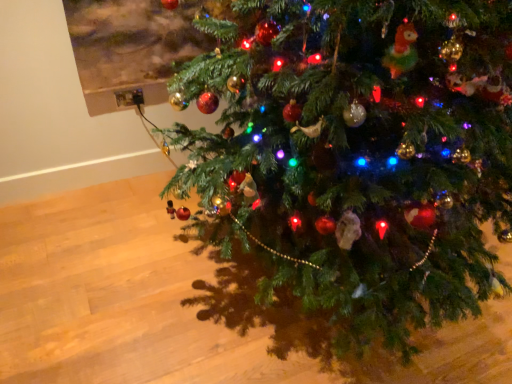
What do you see at coordinates (358, 154) in the screenshot? I see `green matte christmas tree at center` at bounding box center [358, 154].

Where is `green matte christmas tree at center`? green matte christmas tree at center is located at coordinates (358, 154).

This screenshot has height=384, width=512. In order to click on green matte christmas tree at center in this screenshot , I will do `click(358, 154)`.